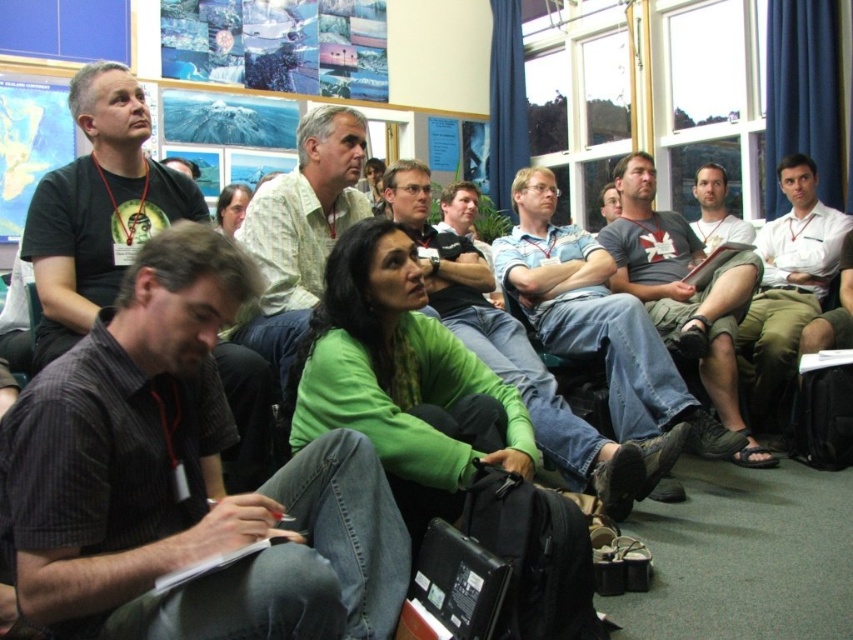
Can you confirm if green matte sweater at center is wider than matte gray shirt at center?

Yes, green matte sweater at center is wider than matte gray shirt at center.

Locate an element on the screen. This screenshot has height=640, width=853. green matte sweater at center is located at coordinates (520, 355).

Identify the location of green matte sweater at center. The image size is (853, 640). (520, 355).

Can you confirm if gray cotton t-shirt at center is thinner than light green shirt at center?

Incorrect, gray cotton t-shirt at center's width is not less than light green shirt at center's.

Does gray cotton t-shirt at center have a greater height compared to light green shirt at center?

Correct, gray cotton t-shirt at center is much taller as light green shirt at center.

Which is in front, point (628, 195) or point (294, 205)?

Point (294, 205)

I want to click on gray cotton t-shirt at center, so click(x=683, y=291).

Does point (607, 444) lie behind point (750, 310)?

No, (607, 444) is closer to viewer.

Does green matte sweater at center have a greater width compared to white shirt at center?

Yes.

Is point (656, 465) more distant than point (842, 234)?

That is False.

Locate an element on the screen. This screenshot has width=853, height=640. green matte sweater at center is located at coordinates (520, 355).